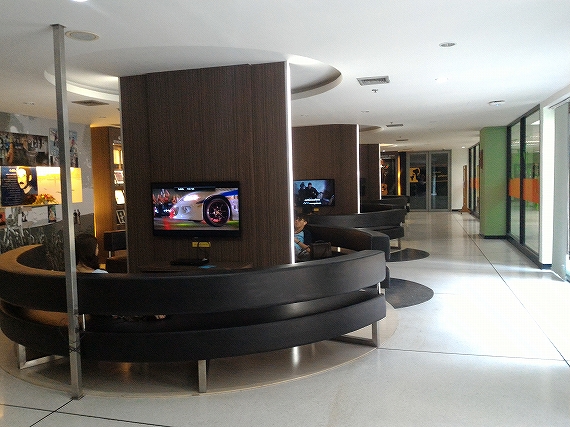
You are a GUI agent. You are given a task and a screenshot of the screen. Output one action in this format:
    pyautogui.click(x=<x>, y=<y>)
    Task: Click on the wooden wall
    
    Given the screenshot: What is the action you would take?
    pyautogui.click(x=301, y=150), pyautogui.click(x=335, y=151), pyautogui.click(x=345, y=189), pyautogui.click(x=146, y=120), pyautogui.click(x=199, y=126), pyautogui.click(x=260, y=140), pyautogui.click(x=266, y=215), pyautogui.click(x=367, y=154)